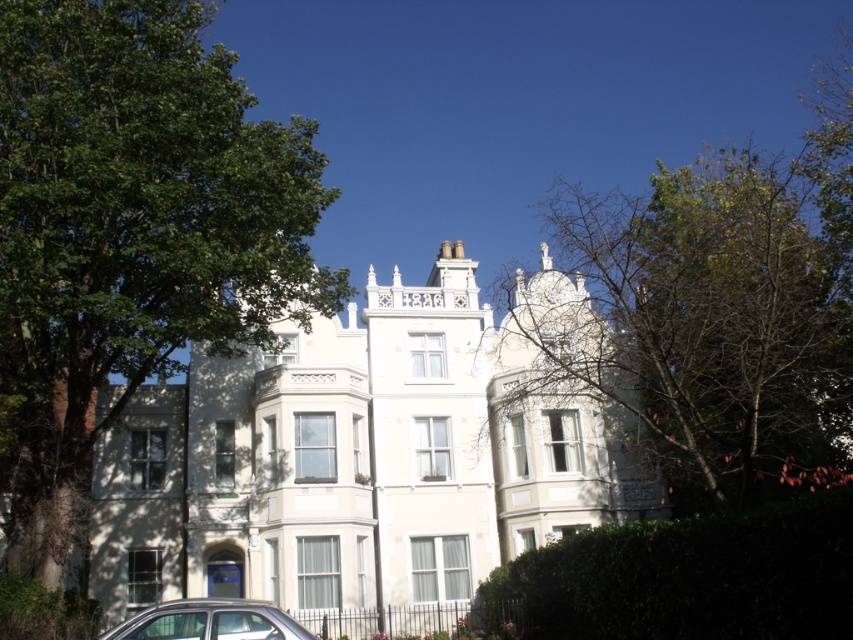
Question: Can you confirm if green leafy tree at left is wider than green leafy tree at upper right?

Choices:
 (A) yes
 (B) no

Answer: (B)

Question: Which of the following is the closest to the observer?

Choices:
 (A) green leafy hedge at lower right
 (B) silver metallic car at lower left
 (C) green leafy tree at upper right

Answer: (A)

Question: Which object is positioned closest to the green leafy tree at left?

Choices:
 (A) silver metallic car at lower left
 (B) green leafy tree at upper right
 (C) green leafy hedge at lower right

Answer: (A)

Question: Is green leafy hedge at lower right to the right of silver metallic car at lower left from the viewer's perspective?

Choices:
 (A) yes
 (B) no

Answer: (A)

Question: Which object is the farthest from the green leafy hedge at lower right?

Choices:
 (A) green leafy tree at left
 (B) silver metallic car at lower left
 (C) green leafy tree at upper right

Answer: (A)

Question: Can you confirm if green leafy hedge at lower right is positioned above silver metallic car at lower left?

Choices:
 (A) no
 (B) yes

Answer: (B)